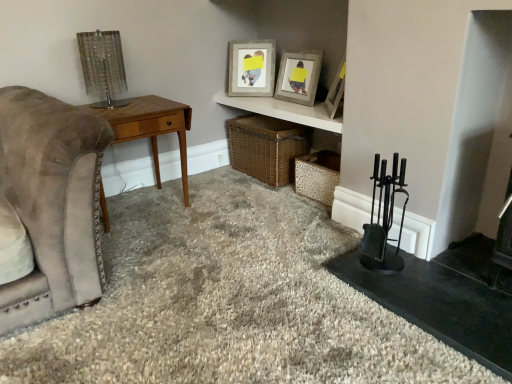
Question: Does wooden desk at left have a lesser height compared to matte wooden shelf at upper center?

Choices:
 (A) no
 (B) yes

Answer: (A)

Question: Considering the relative sizes of wooden desk at left and matte wooden shelf at upper center in the image provided, is wooden desk at left wider than matte wooden shelf at upper center?

Choices:
 (A) yes
 (B) no

Answer: (A)

Question: From a real-world perspective, is wooden desk at left physically above matte wooden shelf at upper center?

Choices:
 (A) no
 (B) yes

Answer: (A)

Question: Can you confirm if wooden desk at left is positioned to the left of matte wooden shelf at upper center?

Choices:
 (A) yes
 (B) no

Answer: (A)

Question: Is wooden desk at left bigger than matte wooden shelf at upper center?

Choices:
 (A) yes
 (B) no

Answer: (A)

Question: From a real-world perspective, is wooden desk at left positioned under matte wooden shelf at upper center based on gravity?

Choices:
 (A) no
 (B) yes

Answer: (B)

Question: Could you tell me if wooden picture frame at upper center, the 3th picture frame viewed from the right, is turned towards wooden picture frame at upper center, the second picture frame in the left-to-right sequence?

Choices:
 (A) yes
 (B) no

Answer: (B)

Question: Does wooden picture frame at upper center, the 3th picture frame viewed from the right, have a smaller size compared to wooden picture frame at upper center, placed as the second picture frame when sorted from right to left?

Choices:
 (A) no
 (B) yes

Answer: (B)

Question: From a real-world perspective, is wooden picture frame at upper center, which is counted as the first picture frame, starting from the left, physically above wooden picture frame at upper center, placed as the second picture frame when sorted from right to left?

Choices:
 (A) yes
 (B) no

Answer: (A)

Question: From the image's perspective, is wooden picture frame at upper center, the 3th picture frame viewed from the right, above wooden picture frame at upper center, placed as the second picture frame when sorted from right to left?

Choices:
 (A) yes
 (B) no

Answer: (A)

Question: Does wooden picture frame at upper center, which is counted as the first picture frame, starting from the left, have a lesser width compared to wooden picture frame at upper center, the second picture frame in the left-to-right sequence?

Choices:
 (A) no
 (B) yes

Answer: (B)

Question: Is wooden picture frame at upper center, the 3th picture frame viewed from the right, not close to wooden picture frame at upper center, the second picture frame in the left-to-right sequence?

Choices:
 (A) yes
 (B) no

Answer: (B)

Question: From a real-world perspective, is wooden picture frame at upper center, the second picture frame in the left-to-right sequence, over metallic textured crate at lower right, arranged as the 2th crate when viewed from the left?

Choices:
 (A) no
 (B) yes

Answer: (B)